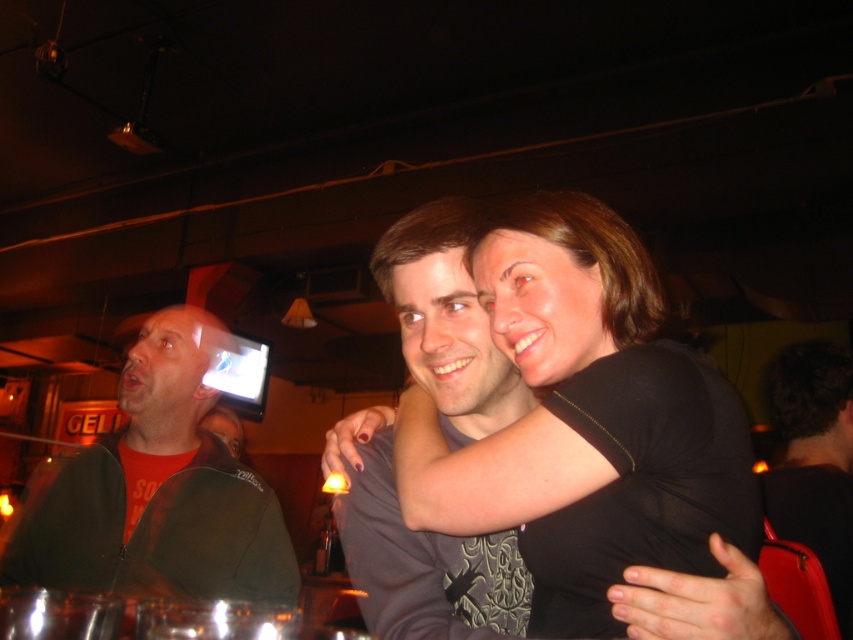
Is black matte shirt at center in front of dark brown hair at upper right?

Yes, it is in front of dark brown hair at upper right.

The image size is (853, 640). What do you see at coordinates (585, 420) in the screenshot? I see `black matte shirt at center` at bounding box center [585, 420].

Image resolution: width=853 pixels, height=640 pixels. Identify the location of black matte shirt at center. (585, 420).

Is black matte shirt at center below orange matte shirt at left?

Incorrect, black matte shirt at center is not positioned below orange matte shirt at left.

Is point (677, 502) closer to camera compared to point (204, 536)?

Yes, point (677, 502) is in front of point (204, 536).

Between point (403, 401) and point (190, 458), which one is positioned in front?

Point (403, 401) is more forward.

Identify the location of black matte shirt at center. (585, 420).

Is orange matte shirt at left to the left of dark brown hair at upper right from the viewer's perspective?

Indeed, orange matte shirt at left is positioned on the left side of dark brown hair at upper right.

Which is above, orange matte shirt at left or dark brown hair at upper right?

orange matte shirt at left

Describe the element at coordinates (155, 492) in the screenshot. I see `orange matte shirt at left` at that location.

Image resolution: width=853 pixels, height=640 pixels. What are the coordinates of `orange matte shirt at left` in the screenshot? It's located at (155, 492).